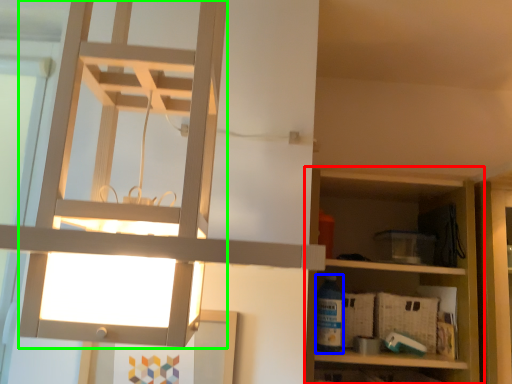
Question: Estimate the real-world distances between objects in this image. Which object is farther from shelf (highlighted by a red box), bottle (highlighted by a blue box) or lamp (highlighted by a green box)?

Choices:
 (A) bottle
 (B) lamp

Answer: (B)